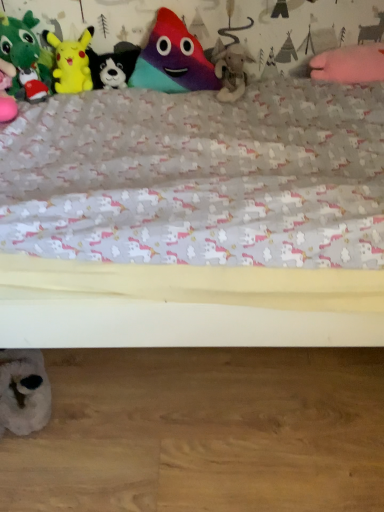
Where is `vacant space to the right of white plush toy at lower left, which appears as the 1th toy when ordered from the bottom`? vacant space to the right of white plush toy at lower left, which appears as the 1th toy when ordered from the bottom is located at coordinates (92, 400).